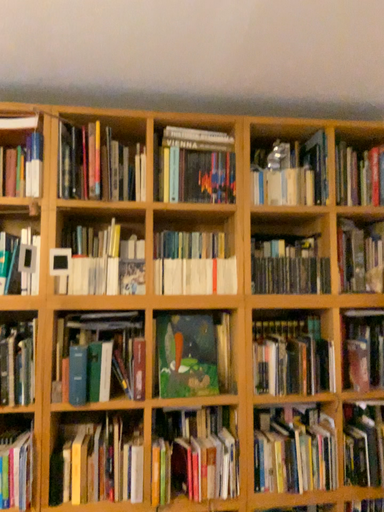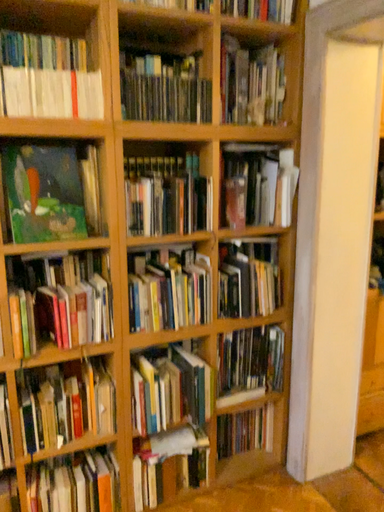
Question: Which way did the camera rotate in the video?

Choices:
 (A) rotated right
 (B) rotated left

Answer: (A)